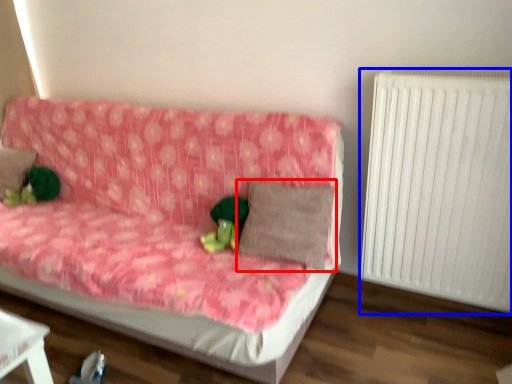
Question: Which of the following is the closest to the observer, pillow (highlighted by a red box) or radiator (highlighted by a blue box)?

Choices:
 (A) pillow
 (B) radiator

Answer: (B)